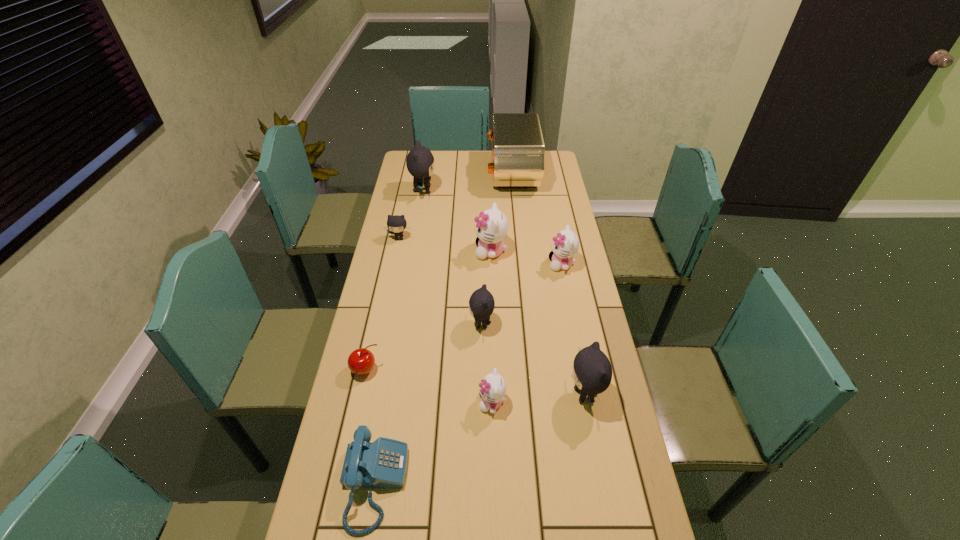
Identify the location of the smallest gray kitten. (396, 223).

This screenshot has height=540, width=960. I want to click on cherry, so click(361, 361).

Find the location of a particular element. blue telephone is located at coordinates (383, 463).

Locate an element on the screen. the nearest object is located at coordinates (383, 463).

Locate an element on the screen. This screenshot has height=540, width=960. free space located on the door side of the toaster oven is located at coordinates (443, 175).

You are a GUI agent. You are given a task and a screenshot of the screen. Output one action in this format:
    pyautogui.click(x=<x>, y=<y>)
    Task: Click on the free space located 0.400m on the door side of the toaster oven
    
    Given the screenshot: What is the action you would take?
    pyautogui.click(x=403, y=175)

You are a GUI agent. You are given a task and a screenshot of the screen. Output one action in this format:
    pyautogui.click(x=<x>, y=<y>)
    Task: Click on the free region located on the door side of the toaster oven
    Image resolution: width=960 pixels, height=540 pixels.
    Given the screenshot: What is the action you would take?
    pyautogui.click(x=403, y=175)

I want to click on vacant space situated on the front-facing side of the farthest kitten, so click(x=514, y=191).

Identify the location of blank space located on the front-facing side of the biggest white kitten. (402, 251).

You are a GUI agent. You are given a task and a screenshot of the screen. Output one action in this format:
    pyautogui.click(x=<x>, y=<y>)
    Task: Click on the vacant area situated on the front-facing side of the biggest white kitten
    
    Given the screenshot: What is the action you would take?
    pyautogui.click(x=389, y=251)